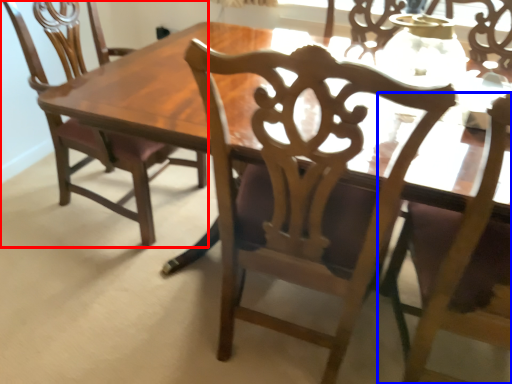
Question: Which point is further to the camera, chair (highlighted by a red box) or chair (highlighted by a blue box)?

Choices:
 (A) chair
 (B) chair

Answer: (A)